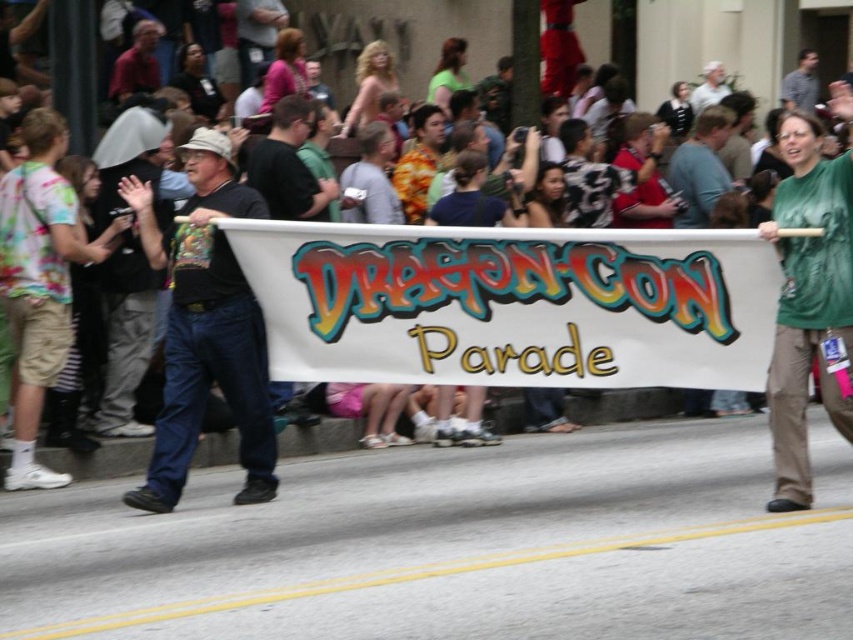
You are a participant in the Dragon Con Parade holding a banner. You notice two points on the banner at coordinates point (151, 32) and point (788, 77). Which point is closer to you?

The point (151, 32) is closer to the viewer than point (788, 77).

You are a photographer at the Dragon Con Parade. You want to take a photo of the green fabric shirt at center and the red shirt at upper left. Which of the two shirts should you zoom in more on to ensure it appears larger in the photo?

The green fabric shirt at center is bigger than the red shirt at upper left, so you should zoom in more on the red shirt at upper left to make it appear larger in the photo.